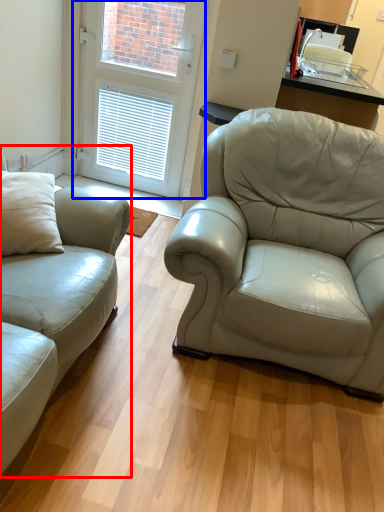
Question: Which point is further to the camera, studio couch (highlighted by a red box) or door (highlighted by a blue box)?

Choices:
 (A) studio couch
 (B) door

Answer: (B)